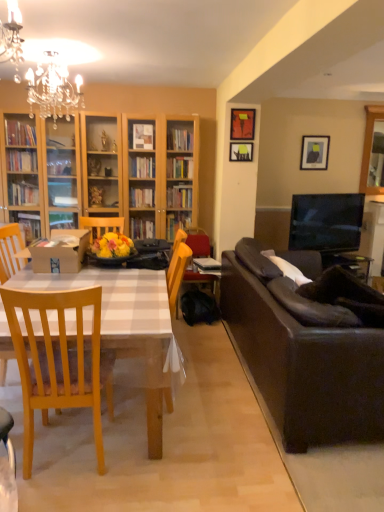
Question: Would you say hardcover book at center is to the left or to the right of light wood chair at left in the picture?

Choices:
 (A) left
 (B) right

Answer: (B)

Question: Looking at their shapes, would you say hardcover book at center is wider or thinner than light wood chair at left?

Choices:
 (A) wide
 (B) thin

Answer: (B)

Question: Which is nearer to the dark brown leather couch at right?

Choices:
 (A) hardcover book at center
 (B) wooden armchair at center
 (C) wooden picture frame at upper center, the second picture frame viewed from the back
 (D) light wood chair at left
 (E) crystal chandelier at upper left

Answer: (B)

Question: Based on their relative distances, which object is farther from the wooden armchair at center?

Choices:
 (A) dark brown leather couch at right
 (B) hardcover book at center
 (C) matte orange picture frame at upper right, marked as the 2th picture frame in a left-to-right arrangement
 (D) light wood chair at left
 (E) matte black picture frame at upper right, which is the 1th picture frame from back to front

Answer: (E)